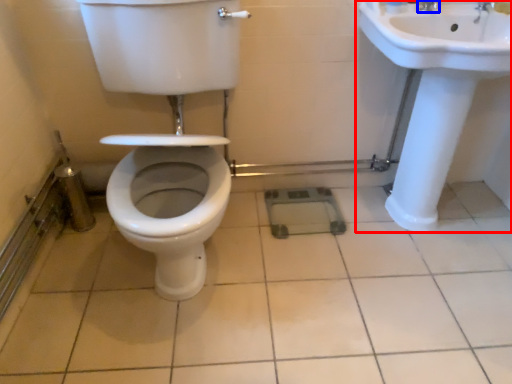
Question: Which object is further to the camera taking this photo, sink (highlighted by a red box) or tap (highlighted by a blue box)?

Choices:
 (A) sink
 (B) tap

Answer: (B)